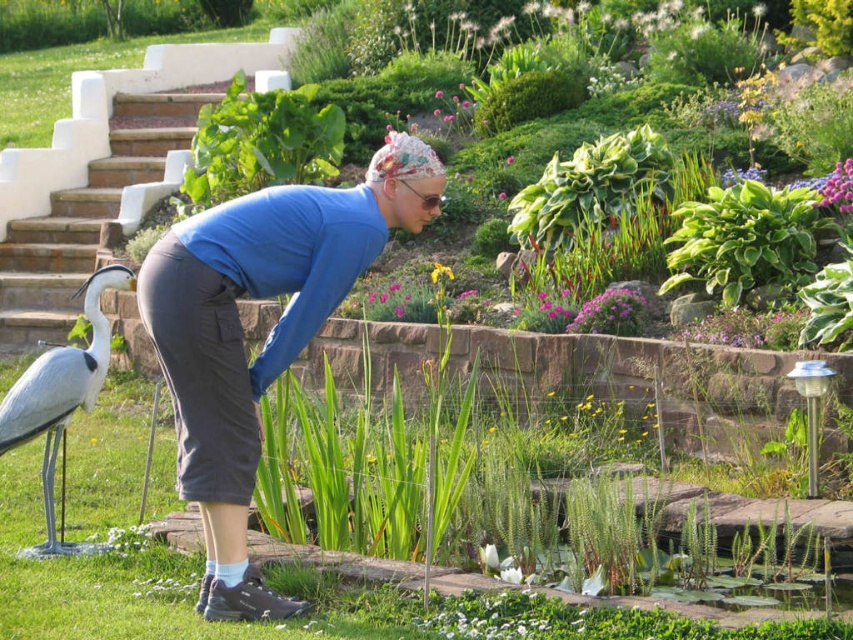
Question: From the image, what is the correct spatial relationship of blue fabric at center in relation to white matte bird at lower left?

Choices:
 (A) above
 (B) below

Answer: (A)

Question: Which object appears farthest from the camera in this image?

Choices:
 (A) white matte bird at lower left
 (B) blue fabric at center

Answer: (A)

Question: From the image, what is the correct spatial relationship of blue fabric at center in relation to white matte bird at lower left?

Choices:
 (A) above
 (B) below

Answer: (A)

Question: Which of the following is the closest to the observer?

Choices:
 (A) (196, 378)
 (B) (83, 394)

Answer: (A)

Question: Is blue fabric at center behind white matte bird at lower left?

Choices:
 (A) no
 (B) yes

Answer: (A)

Question: Which point is farther to the camera?

Choices:
 (A) blue fabric at center
 (B) white matte bird at lower left

Answer: (B)